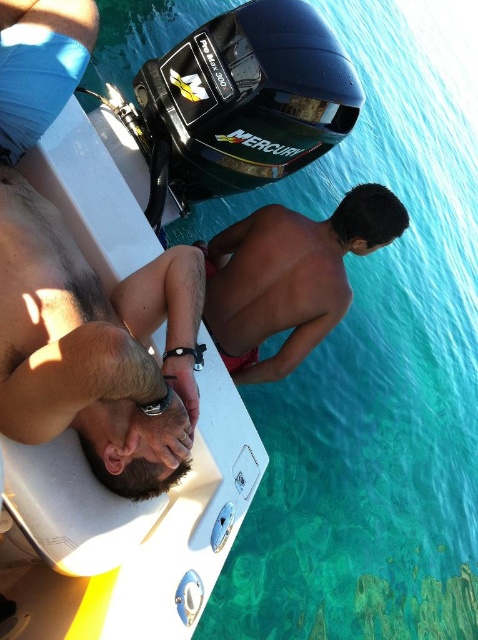
Question: Observing the image, what is the correct spatial positioning of smooth skin man at lower left in reference to black plastic motor at upper center?

Choices:
 (A) right
 (B) left

Answer: (B)

Question: Does white plastic boat at upper center have a larger size compared to black plastic motor at upper center?

Choices:
 (A) yes
 (B) no

Answer: (B)

Question: Does white plastic boat at upper center have a smaller size compared to smooth skin man at lower left?

Choices:
 (A) no
 (B) yes

Answer: (A)

Question: Which point appears closest to the camera in this image?

Choices:
 (A) (17, 404)
 (B) (108, 99)
 (C) (63, 416)

Answer: (A)

Question: Which object is positioned closest to the smooth skin man at lower left?

Choices:
 (A) white plastic boat at upper center
 (B) smooth skin torso at center
 (C) black plastic motor at upper center

Answer: (A)

Question: Which object is the closest to the white plastic boat at upper center?

Choices:
 (A) smooth skin man at lower left
 (B) black plastic motor at upper center
 (C) smooth skin torso at center

Answer: (A)